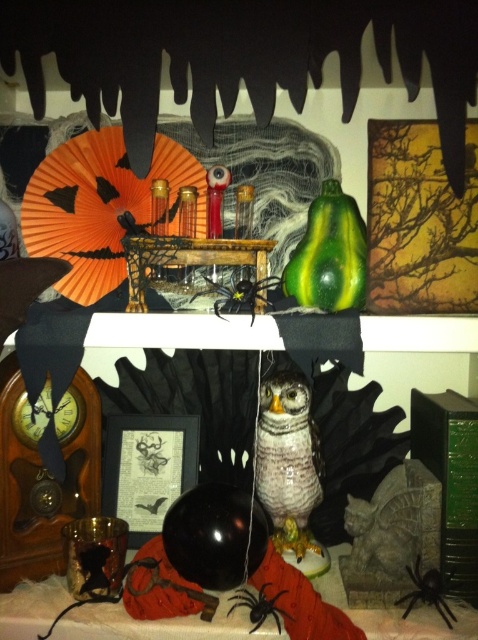
Question: Based on their relative distances, which object is farther from the matte black frame at center?

Choices:
 (A) speckled ceramic owl at center
 (B) black glossy spider at center
 (C) black fuzzy spider at lower right

Answer: (C)

Question: Among these objects, which one is nearest to the camera?

Choices:
 (A) matte black frame at center
 (B) black glossy spider at center
 (C) speckled ceramic owl at center

Answer: (B)

Question: Is matte black frame at center positioned at the back of black fuzzy spider at lower right?

Choices:
 (A) no
 (B) yes

Answer: (B)

Question: Which point is closer to the camera taking this photo?

Choices:
 (A) (165, 452)
 (B) (444, 612)
 (C) (324, 593)
 (D) (249, 616)

Answer: (B)

Question: Can you confirm if speckled ceramic owl at center is wider than black glossy spider at center?

Choices:
 (A) no
 (B) yes

Answer: (A)

Question: Does matte black frame at center appear over speckled ceramic owl at center?

Choices:
 (A) no
 (B) yes

Answer: (A)